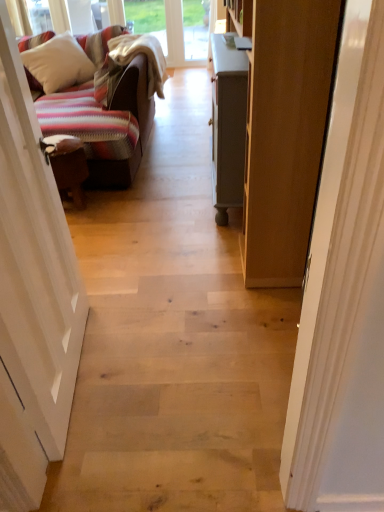
Question: Considering the relative positions of white painted wood door at right, arranged as the 2th door when viewed from the left, and white soft pillow at upper left in the image provided, is white painted wood door at right, arranged as the 2th door when viewed from the left, behind white soft pillow at upper left?

Choices:
 (A) yes
 (B) no

Answer: (B)

Question: Could you tell me if white painted wood door at right, arranged as the 2th door when viewed from the left, is facing white soft pillow at upper left?

Choices:
 (A) yes
 (B) no

Answer: (B)

Question: Can we say white painted wood door at right, the first door from the right, lies outside white soft pillow at upper left?

Choices:
 (A) no
 (B) yes

Answer: (B)

Question: Would you consider white painted wood door at right, the first door from the right, to be distant from white soft pillow at upper left?

Choices:
 (A) yes
 (B) no

Answer: (A)

Question: Considering the relative sizes of white painted wood door at right, the first door from the right, and white soft pillow at upper left in the image provided, is white painted wood door at right, the first door from the right, bigger than white soft pillow at upper left?

Choices:
 (A) no
 (B) yes

Answer: (A)

Question: Is white painted wood door at right, the first door from the right, closer to the viewer compared to white soft pillow at upper left?

Choices:
 (A) no
 (B) yes

Answer: (B)

Question: Is white wood door at left, the 1th door viewed from the left, positioned far away from white soft pillow at upper left?

Choices:
 (A) no
 (B) yes

Answer: (B)

Question: Does white wood door at left, the 1th door viewed from the left, have a smaller size compared to white soft pillow at upper left?

Choices:
 (A) yes
 (B) no

Answer: (A)

Question: Is white wood door at left, the 1th door viewed from the left, at the right side of white soft pillow at upper left?

Choices:
 (A) yes
 (B) no

Answer: (A)

Question: Can we say white wood door at left, the 1th door viewed from the left, lies outside white soft pillow at upper left?

Choices:
 (A) no
 (B) yes

Answer: (B)

Question: From the image's perspective, is white wood door at left, the 2th door viewed from the right, beneath white soft pillow at upper left?

Choices:
 (A) no
 (B) yes

Answer: (B)

Question: From a real-world perspective, is white wood door at left, the 2th door viewed from the right, located higher than white soft pillow at upper left?

Choices:
 (A) yes
 (B) no

Answer: (A)

Question: Are white soft pillow at upper left and white wood door at left, the 1th door viewed from the left, located far from each other?

Choices:
 (A) yes
 (B) no

Answer: (A)